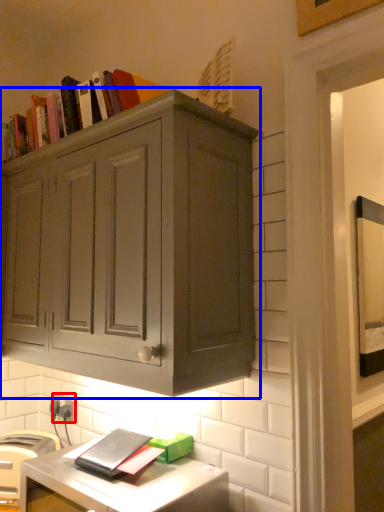
Question: Among these objects, which one is nearest to the camera, electric outlet (highlighted by a red box) or cabinetry (highlighted by a blue box)?

Choices:
 (A) electric outlet
 (B) cabinetry

Answer: (B)